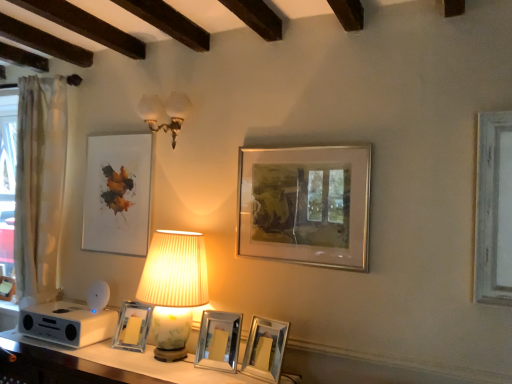
Question: Visually, is white glass sconce at upper center, positioned as the second lamp in bottom-to-top order, positioned to the left or to the right of silver/metallic picture frame at center-right, which appears as the fifth picture frame when viewed from the left?

Choices:
 (A) right
 (B) left

Answer: (B)

Question: In terms of height, does white glass sconce at upper center, which ranks as the 1th lamp in top-to-bottom order, look taller or shorter compared to silver/metallic picture frame at center-right, the 1th picture frame when ordered from right to left?

Choices:
 (A) short
 (B) tall

Answer: (A)

Question: Which object is positioned farthest from the metallic silver picture frame at lower center, the second picture frame from the right?

Choices:
 (A) white glass sconce at upper center, positioned as the second lamp in bottom-to-top order
 (B) white glossy table at lower center
 (C) matte white lampshade at center, the 1th lamp ordered from the bottom
 (D) white sheer curtain at left
 (E) matte white picture frame at upper left, which is counted as the first picture frame, starting from the left

Answer: (D)

Question: Estimate the real-world distances between objects in this image. Which object is closer to the white glass sconce at upper center, which ranks as the 1th lamp in top-to-bottom order?

Choices:
 (A) matte white picture frame at upper left, which is counted as the first picture frame, starting from the left
 (B) clear glass photo frame at center, the second picture frame from the left
 (C) silver metallic picture frame at center, which is the 3th picture frame from right to left
 (D) silver/metallic picture frame at center-right, which appears as the fifth picture frame when viewed from the left
 (E) metallic silver picture frame at lower center, the 4th picture frame in the left-to-right sequence

Answer: (A)